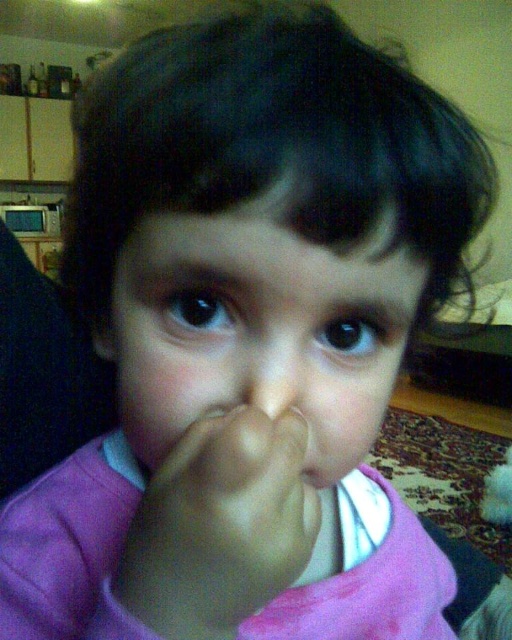
Can you confirm if smooth skin nose at center is positioned to the left of smooth white mouth at center?

Correct, you'll find smooth skin nose at center to the left of smooth white mouth at center.

Is point (260, 387) closer to viewer compared to point (306, 476)?

Yes, it is in front of point (306, 476).

This screenshot has width=512, height=640. Identify the location of smooth skin nose at center. (272, 378).

Does smooth skin face at center appear under smooth skin nose at center?

No.

Does smooth skin face at center have a lesser width compared to smooth skin nose at center?

No, smooth skin face at center is not thinner than smooth skin nose at center.

Who is more distant from viewer, (137,385) or (252,378)?

The point (137,385) is behind.

You are a GUI agent. You are given a task and a screenshot of the screen. Output one action in this format:
    pyautogui.click(x=<x>, y=<y>)
    Task: Click on the smooth skin face at center
    
    Given the screenshot: What is the action you would take?
    pyautogui.click(x=260, y=330)

Who is positioned more to the right, smooth skin face at center or skinny flesh-toned finger at center?

smooth skin face at center

Does smooth skin face at center have a lesser height compared to skinny flesh-toned finger at center?

No.

The height and width of the screenshot is (640, 512). What do you see at coordinates (260, 330) in the screenshot?
I see `smooth skin face at center` at bounding box center [260, 330].

This screenshot has height=640, width=512. Identify the location of smooth skin face at center. (260, 330).